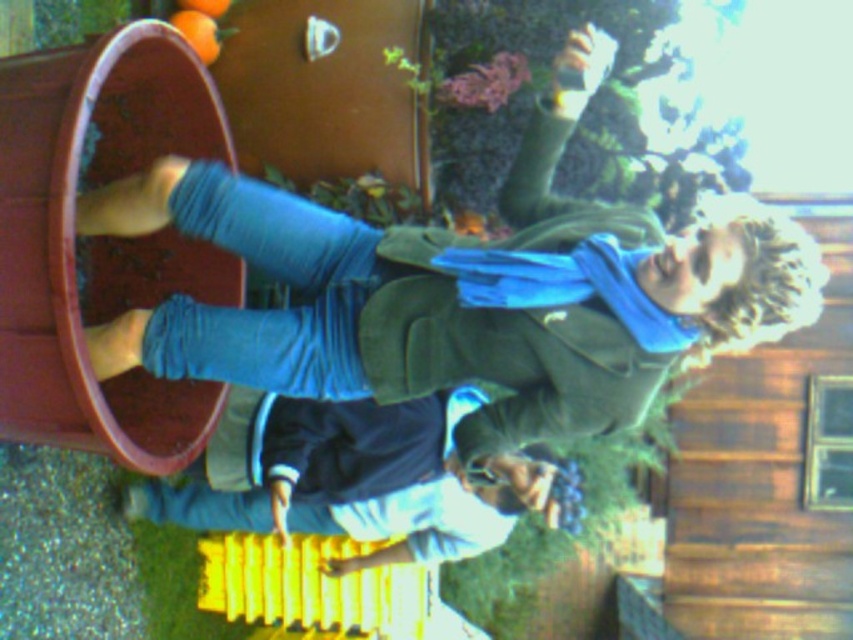
Is dark blue jeans at lower center to the left of orange matte at upper center from the viewer's perspective?

In fact, dark blue jeans at lower center is to the right of orange matte at upper center.

Can you confirm if dark blue jeans at lower center is bigger than orange matte at upper center?

Yes, dark blue jeans at lower center is bigger than orange matte at upper center.

Between point (434, 552) and point (219, 49), which one is positioned behind?

Positioned behind is point (434, 552).

The width and height of the screenshot is (853, 640). What are the coordinates of `dark blue jeans at lower center` in the screenshot? It's located at (349, 477).

Does orange matte at upper center come behind smooth orange at upper center?

No, it is in front of smooth orange at upper center.

Can you confirm if orange matte at upper center is shorter than smooth orange at upper center?

In fact, orange matte at upper center may be taller than smooth orange at upper center.

The width and height of the screenshot is (853, 640). In order to click on orange matte at upper center in this screenshot , I will do `click(196, 29)`.

Is the position of blue cotton scarf at upper right less distant than that of orange matte at upper center?

Yes.

Does blue cotton scarf at upper right have a lesser height compared to orange matte at upper center?

No, blue cotton scarf at upper right is not shorter than orange matte at upper center.

This screenshot has width=853, height=640. Identify the location of blue cotton scarf at upper right. (467, 289).